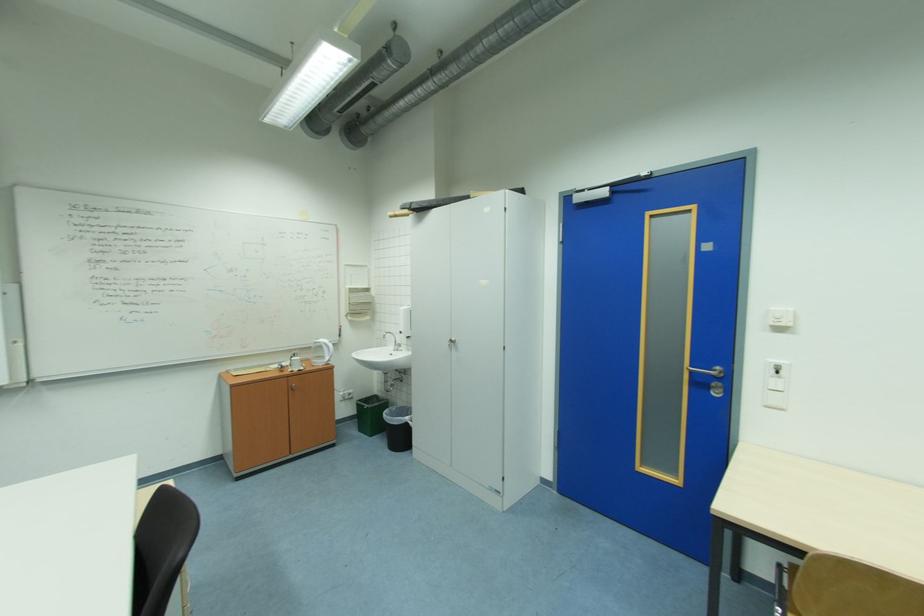
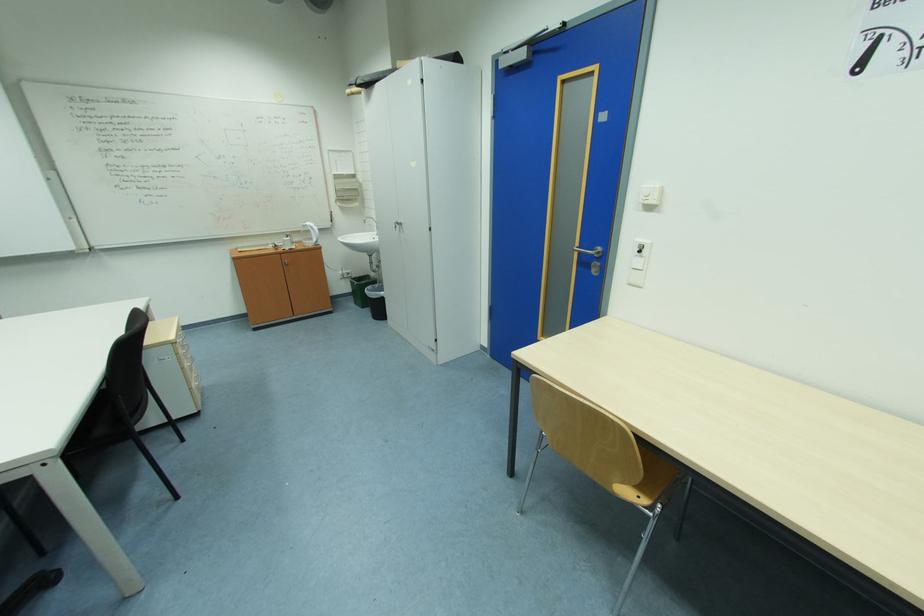
The point at (369, 431) is marked in the first image. Where is the corresponding point in the second image?

(362, 304)